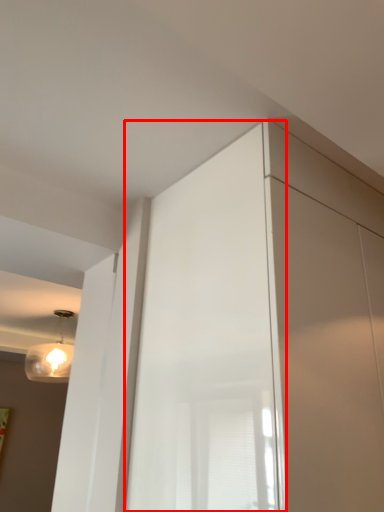
Question: Observing the image, what is the correct spatial positioning of screen door (annotated by the red box) in reference to lamp?

Choices:
 (A) left
 (B) right

Answer: (B)